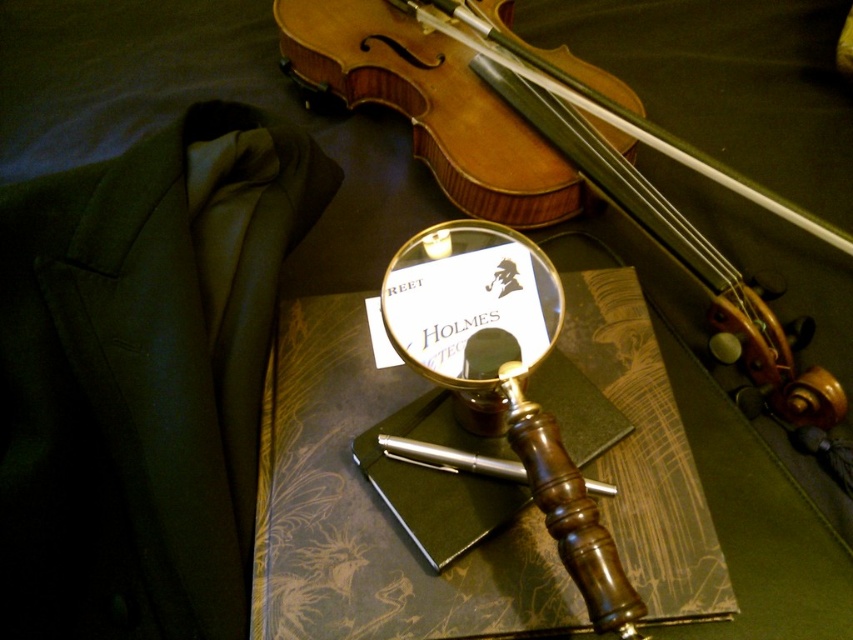
Question: Considering the relative positions of wooden violin at upper center and gold polished magnifying glass at center in the image provided, where is wooden violin at upper center located with respect to gold polished magnifying glass at center?

Choices:
 (A) left
 (B) right

Answer: (B)

Question: From the image, what is the correct spatial relationship of wooden violin at upper center in relation to gold polished magnifying glass at center?

Choices:
 (A) right
 (B) left

Answer: (A)

Question: Which point is farther to the camera?

Choices:
 (A) gold polished magnifying glass at center
 (B) wooden violin at upper center

Answer: (B)

Question: Among these points, which one is farthest from the camera?

Choices:
 (A) (477, 394)
 (B) (289, 36)

Answer: (B)

Question: Can you confirm if wooden violin at upper center is positioned below gold polished magnifying glass at center?

Choices:
 (A) yes
 (B) no

Answer: (B)